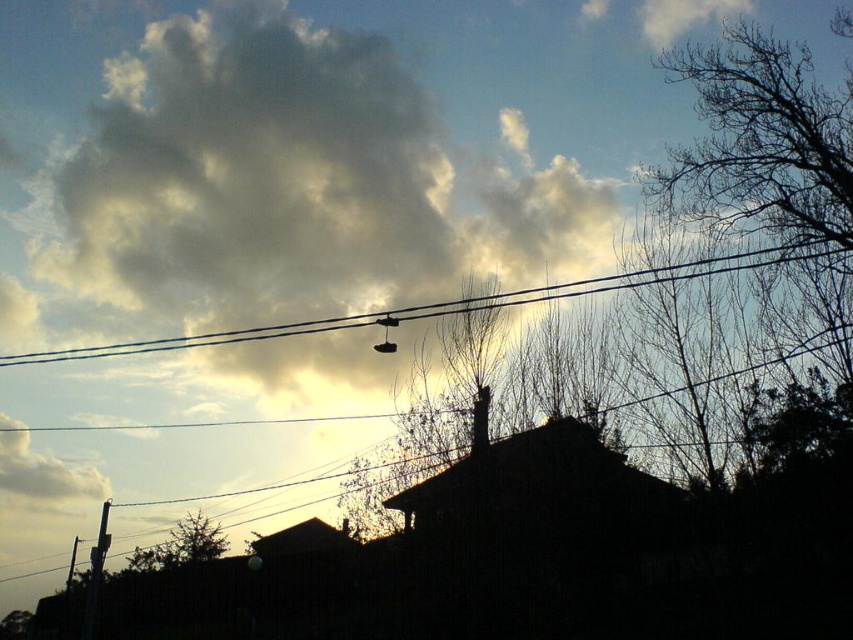
In the scene shown: Does black wire at center appear over white fluffy cloud at upper left?

Yes, black wire at center is above white fluffy cloud at upper left.

Is black wire at center to the left of white fluffy cloud at upper left from the viewer's perspective?

No, black wire at center is not to the left of white fluffy cloud at upper left.

Identify the location of black wire at center. (448, 305).